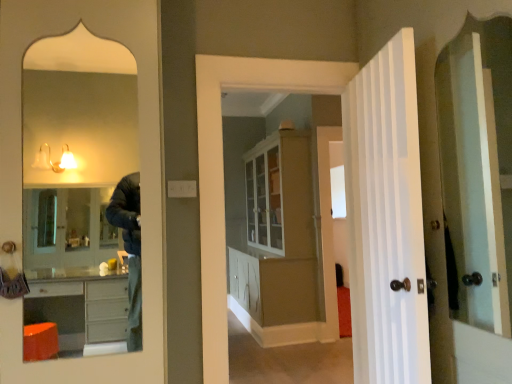
Question: From a real-world perspective, is white glossy cabinet at center over white painted wood door at right?

Choices:
 (A) no
 (B) yes

Answer: (A)

Question: Could you tell me if white glossy cabinet at center is facing white painted wood door at right?

Choices:
 (A) yes
 (B) no

Answer: (B)

Question: Can white painted wood door at right be found inside white glossy cabinet at center?

Choices:
 (A) no
 (B) yes

Answer: (A)

Question: Considering the relative positions of white glossy cabinet at center and white painted wood door at right in the image provided, is white glossy cabinet at center in front of white painted wood door at right?

Choices:
 (A) yes
 (B) no

Answer: (B)

Question: From the image's perspective, is white glossy cabinet at center below white painted wood door at right?

Choices:
 (A) no
 (B) yes

Answer: (B)

Question: Is white glossy cabinet at center positioned behind white painted wood door at right?

Choices:
 (A) no
 (B) yes

Answer: (B)

Question: From a real-world perspective, is white painted wood door at right on white glossy cabinet at center?

Choices:
 (A) yes
 (B) no

Answer: (A)

Question: From the image's perspective, would you say white painted wood door at right is shown under white glossy cabinet at center?

Choices:
 (A) yes
 (B) no

Answer: (B)

Question: Does white painted wood door at right have a lesser width compared to white glossy cabinet at center?

Choices:
 (A) yes
 (B) no

Answer: (A)

Question: Considering the relative sizes of white painted wood door at right and white glossy cabinet at center in the image provided, is white painted wood door at right wider than white glossy cabinet at center?

Choices:
 (A) no
 (B) yes

Answer: (A)

Question: Is white glossy cabinet at center located within white painted wood door at right?

Choices:
 (A) no
 (B) yes

Answer: (A)

Question: Considering the relative sizes of white painted wood door at right and white glossy cabinet at center in the image provided, is white painted wood door at right bigger than white glossy cabinet at center?

Choices:
 (A) yes
 (B) no

Answer: (B)

Question: Considering the positions of point (309, 235) and point (410, 185), is point (309, 235) closer or farther from the camera than point (410, 185)?

Choices:
 (A) closer
 (B) farther

Answer: (B)